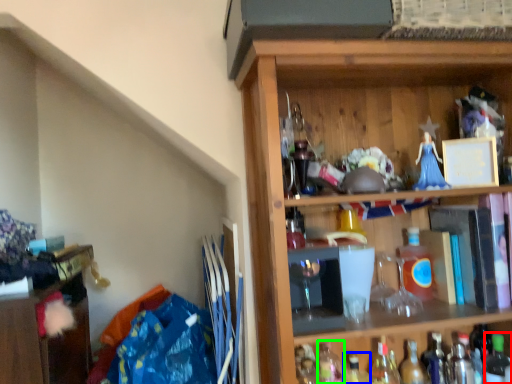
Question: Based on their relative distances, which object is nearer to bottle (highlighted by a red box)? Choose from bottle (highlighted by a blue box) and bottle (highlighted by a green box).

Choices:
 (A) bottle
 (B) bottle

Answer: (A)